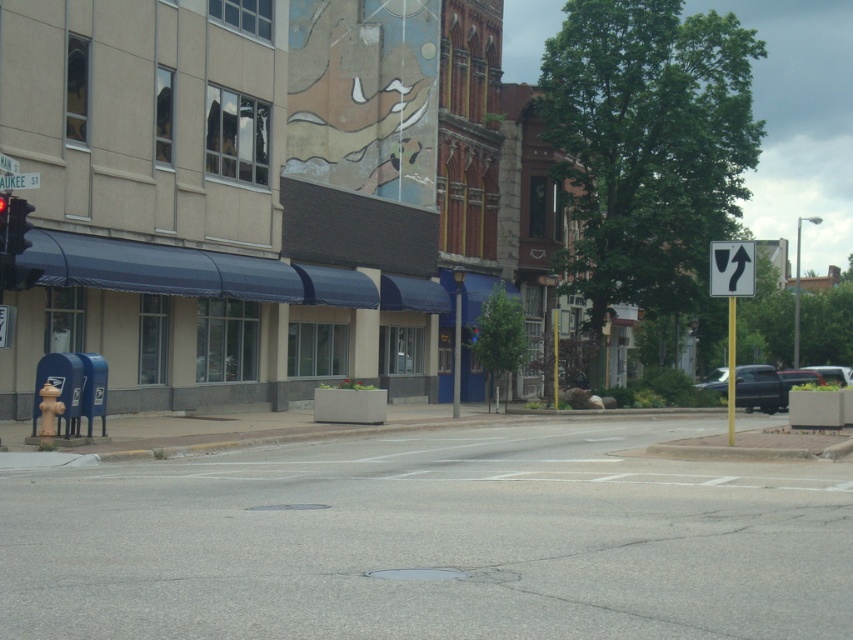
You are a pedestrian wanting to cross the street safely. You see the yellow reflective plastic arrow at upper right and the red glass traffic light at upper center. Which object is positioned lower in the image?

The yellow reflective plastic arrow at upper right is located below the red glass traffic light at upper center, so it is positioned lower in the image.